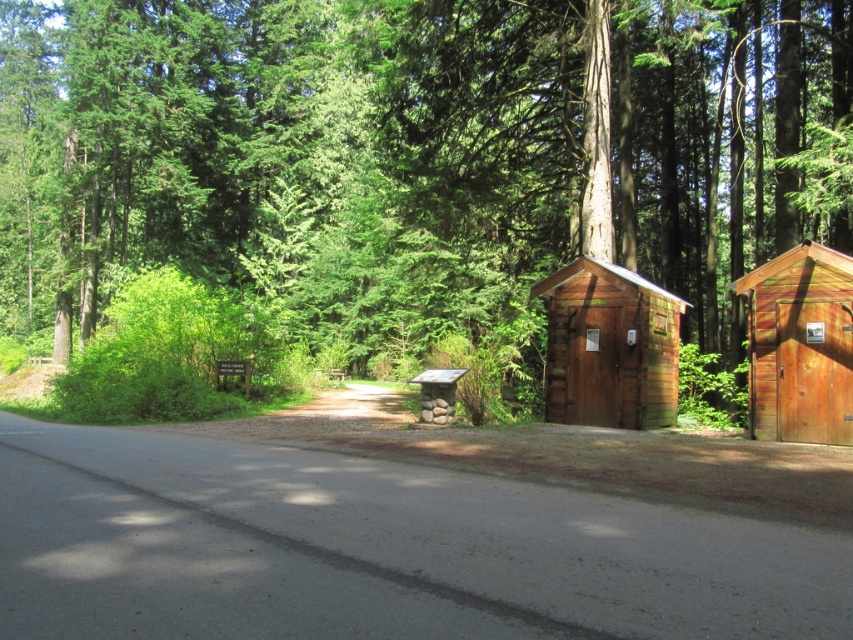
The image size is (853, 640). What do you see at coordinates (399, 182) in the screenshot? I see `brown wooden shed at right` at bounding box center [399, 182].

Is brown wooden shed at right positioned at the back of wooden cabin at right?

Yes, brown wooden shed at right is behind wooden cabin at right.

Which is in front, point (28, 227) or point (758, 426)?

Point (758, 426) is more forward.

Identify the location of brown wooden shed at right. (399, 182).

From the picture: Who is shorter, wooden cabin at center or wooden cabin at right?

With less height is wooden cabin at right.

Between wooden cabin at center and wooden cabin at right, which one appears on the right side from the viewer's perspective?

wooden cabin at right is more to the right.

Describe the element at coordinates (608, 346) in the screenshot. I see `wooden cabin at center` at that location.

The width and height of the screenshot is (853, 640). What are the coordinates of `wooden cabin at center` in the screenshot? It's located at (608, 346).

Is point (412, 353) behind point (608, 356)?

Yes.

Looking at this image, is brown wooden shed at right positioned before wooden cabin at center?

Yes, it is.

Who is more distant from viewer, (65, 160) or (549, 300)?

Positioned behind is point (65, 160).

Locate an element on the screen. The image size is (853, 640). brown wooden shed at right is located at coordinates (399, 182).